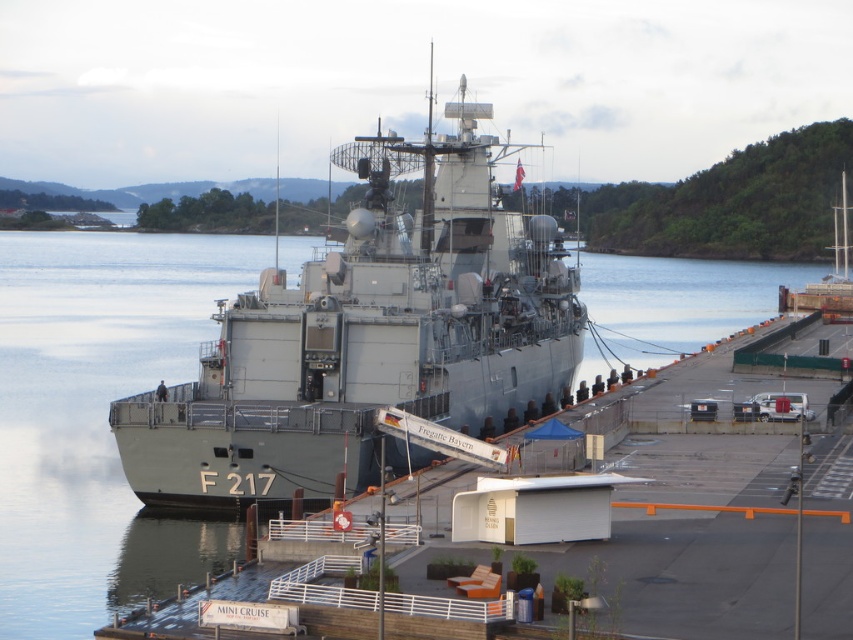
You are standing on the deck of the naval ship F 217 and want to walk towards the MINI CRUISE structure on the dock. The MINI CRUISE is located at point [73,280]. However, there is an obstacle at point [480,236]. Which point should you avoid to reach the MINI CRUISE safely?

You should avoid the point [480,236] because it is in front of the point [73,280] where the MINI CRUISE is located, so walking around or behind it would be necessary to reach your destination safely.

From the picture: You are a drone operator tasked with capturing aerial footage of the gray metallic ship at center. The ship is represented by the point at coordinates point [368,337]. To ensure the ship is centered in the frame, you need to adjust the camera angle so that the point is exactly in the center of the image. What are the coordinates of the point you should aim for?

The coordinates of the point you should aim for are point [368,337], as this is the exact location representing the gray metallic ship at center.

You are standing on the dock and want to locate the gray metallic ship at center. According to the coordinates provided, where exactly is the ship positioned?

The gray metallic ship at center is located at coordinates point (368, 337).